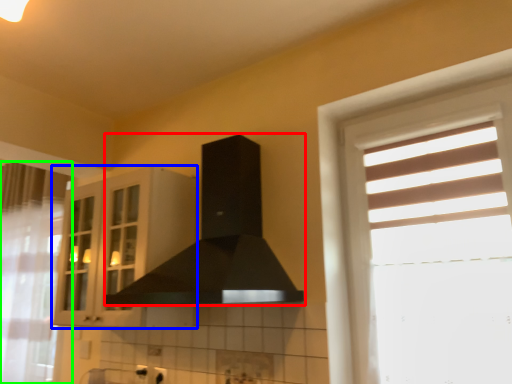
Question: Estimate the real-world distances between objects in this image. Which object is closer to fume hood (highlighted by a red box), cabinetry (highlighted by a blue box) or curtain (highlighted by a green box)?

Choices:
 (A) cabinetry
 (B) curtain

Answer: (A)